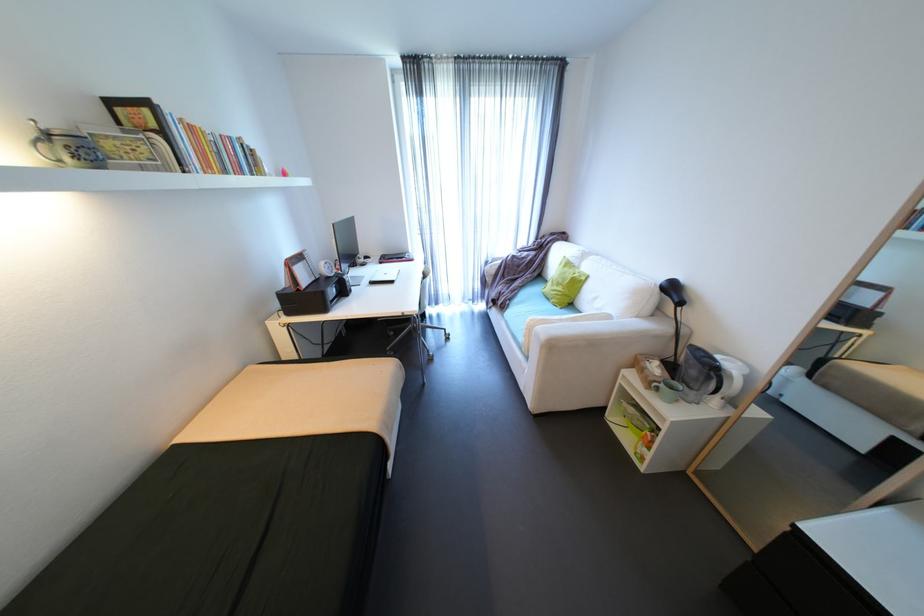
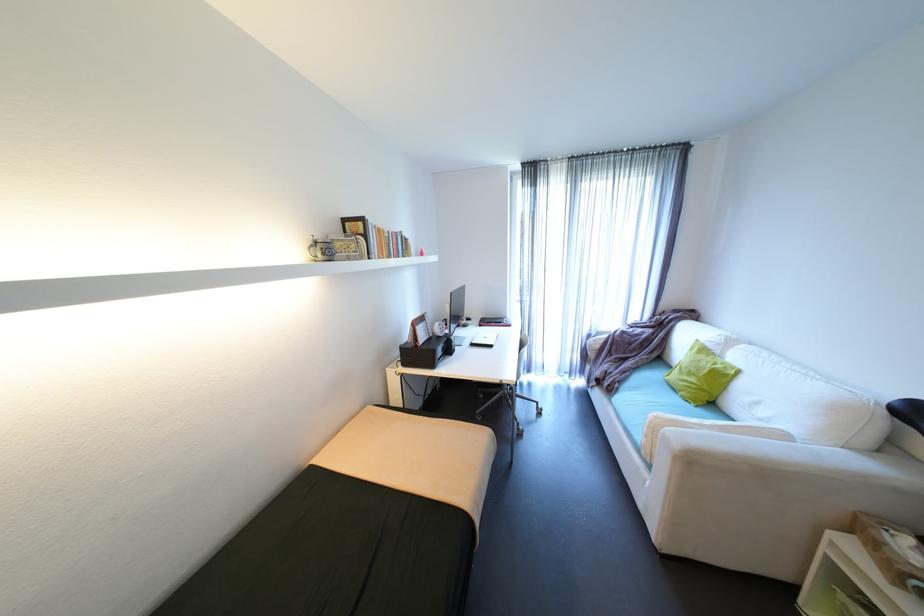
Which direction would the cameraman need to move to produce the second image?

The cameraman walked toward left, backward.